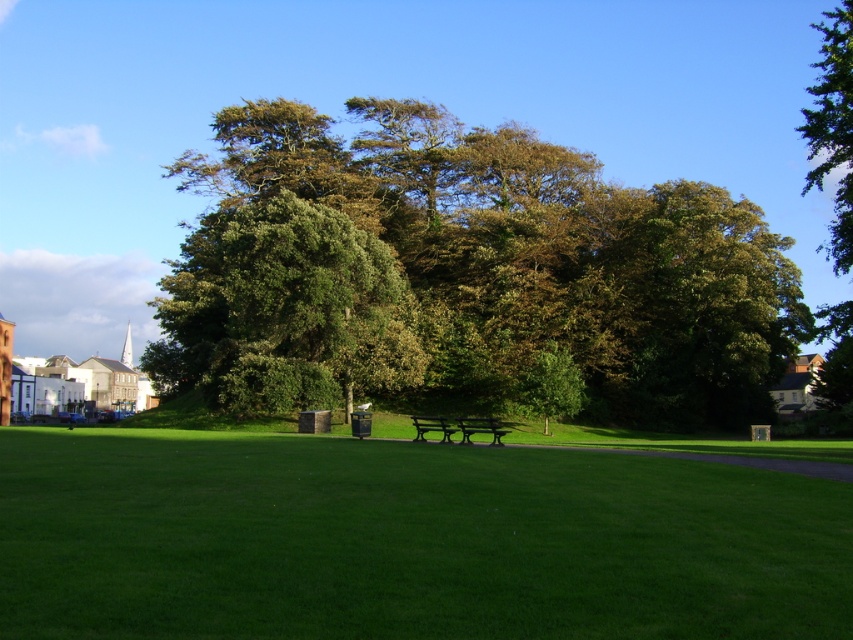
Question: Which of the following is the farthest from the observer?

Choices:
 (A) (x=202, y=460)
 (B) (x=430, y=417)
 (C) (x=490, y=420)

Answer: (B)

Question: Which point is closer to the camera taking this photo?

Choices:
 (A) (846, 164)
 (B) (254, 218)

Answer: (B)

Question: Can you confirm if green leafy tree at center is smaller than green polished wood bench at center?

Choices:
 (A) no
 (B) yes

Answer: (A)

Question: Can you confirm if metallic green bench at center is bigger than green polished wood bench at center?

Choices:
 (A) no
 (B) yes

Answer: (B)

Question: Can you confirm if green grass at center is wider than green polished wood bench at center?

Choices:
 (A) yes
 (B) no

Answer: (A)

Question: Which point is closer to the camera?

Choices:
 (A) (416, 417)
 (B) (724, 608)

Answer: (B)